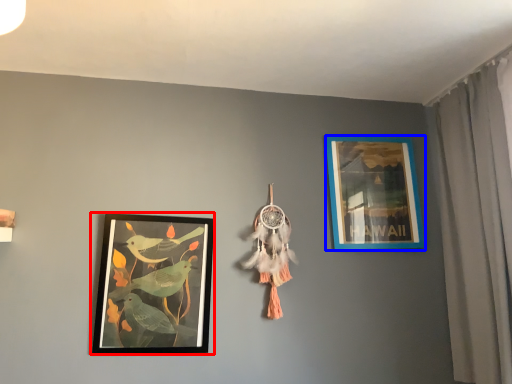
Question: Which of the following is the closest to the observer, picture frame (highlighted by a red box) or picture frame (highlighted by a blue box)?

Choices:
 (A) picture frame
 (B) picture frame

Answer: (A)